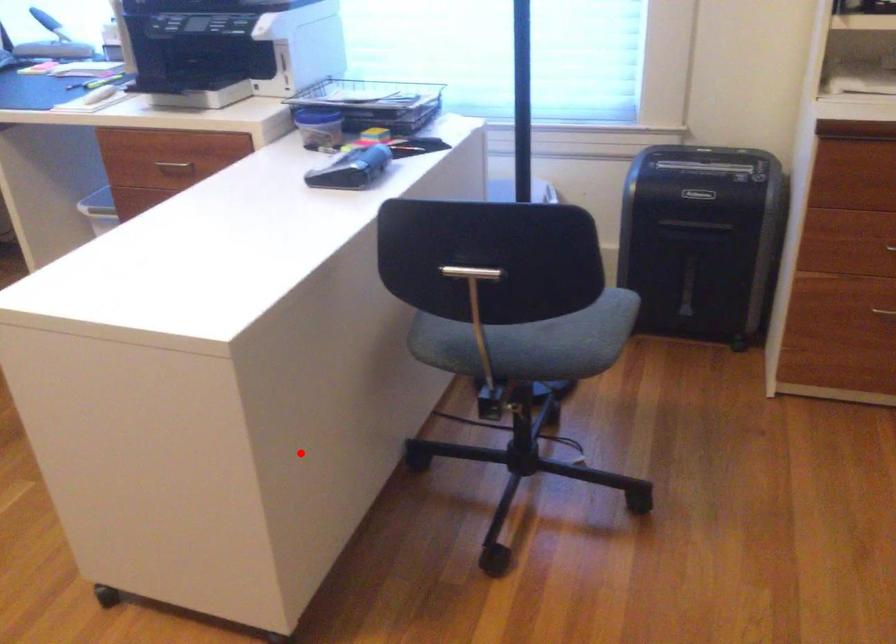
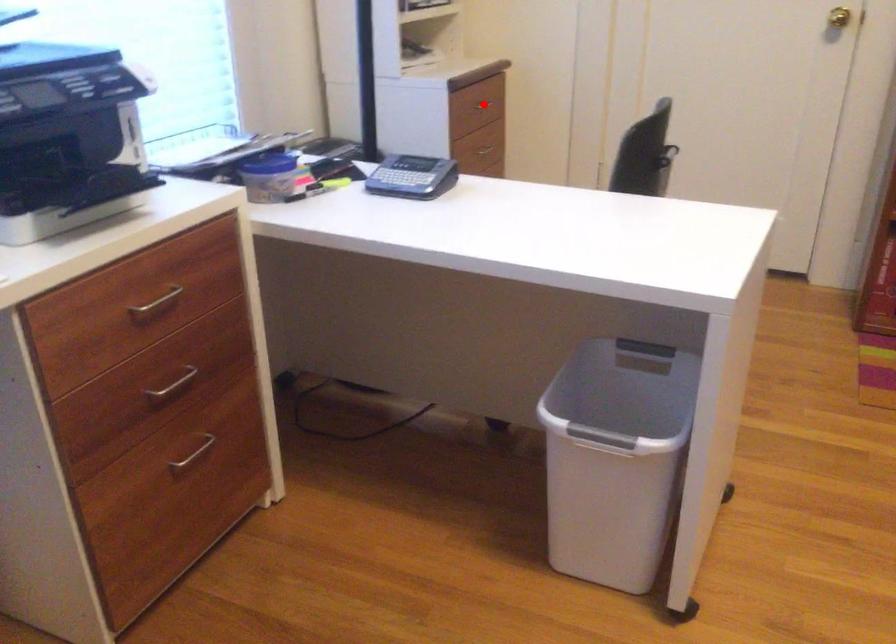
I am providing you with two images of the same scene from different viewpoints. A red point is marked on the first image and another point is marked on the second image. Is the marked point in image1 the same physical position as the marked point in image2?

No